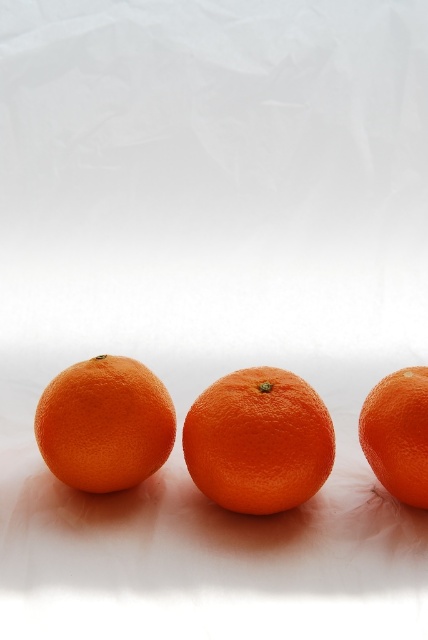
You are arranging oranges on a shelf and want to place a new orange between the orangesmoothorange at center and the orangesmoothorange at right. Based on their current positions, where should you place the new orange?

The new orange should be placed between the orangesmoothorange at center and the orangesmoothorange at right, as the orangesmoothorange at center is to the left of the orangesmoothorange at right.

You are a fruit vendor who wants to arrange two oranges on a shelf. You have an orangesmoothorange at center and an orange matte tangerine at center. If you want to place them side by side with a gap between them, how much space do you need in total considering their sizes and the gap?

The orangesmoothorange at center and orange matte tangerine at center are 5.72 inches apart, so the total space needed would be the sum of their widths plus 5.72 inches. However, since their individual widths are not provided, we cannot calculate the exact total space required.

You are arranging oranges on a shelf and need to place the largest one first. Which of the orangesmoothorange at center or orangesmoothorange at right should you place first?

The orangesmoothorange at center is larger in size than orangesmoothorange at right, so you should place the orangesmoothorange at center first.